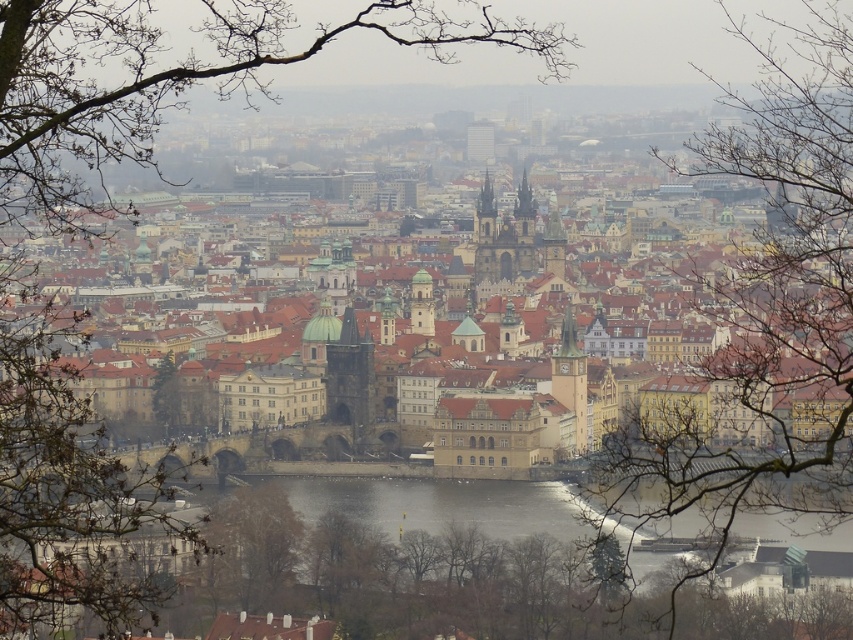
Question: Which point is closer to the camera?

Choices:
 (A) bare branches at upper left
 (B) brown stone clock tower at center
 (C) brown stone church at center
 (D) smooth stone clock tower at center

Answer: (A)

Question: Is dark gray stone tower at center thinner than smooth stone clock tower at center?

Choices:
 (A) no
 (B) yes

Answer: (A)

Question: Which of the following is the closest to the observer?

Choices:
 (A) brown stone town at center
 (B) green leafy tree at center
 (C) bare branches at center

Answer: (A)

Question: Which point appears closest to the camera in this image?

Choices:
 (A) (827, 481)
 (B) (764, 278)
 (C) (415, 308)

Answer: (A)

Question: Is brown stone town at center below brown stone church at center?

Choices:
 (A) yes
 (B) no

Answer: (A)

Question: Can you confirm if bare branches at upper left is bigger than brown stone church at center?

Choices:
 (A) yes
 (B) no

Answer: (A)